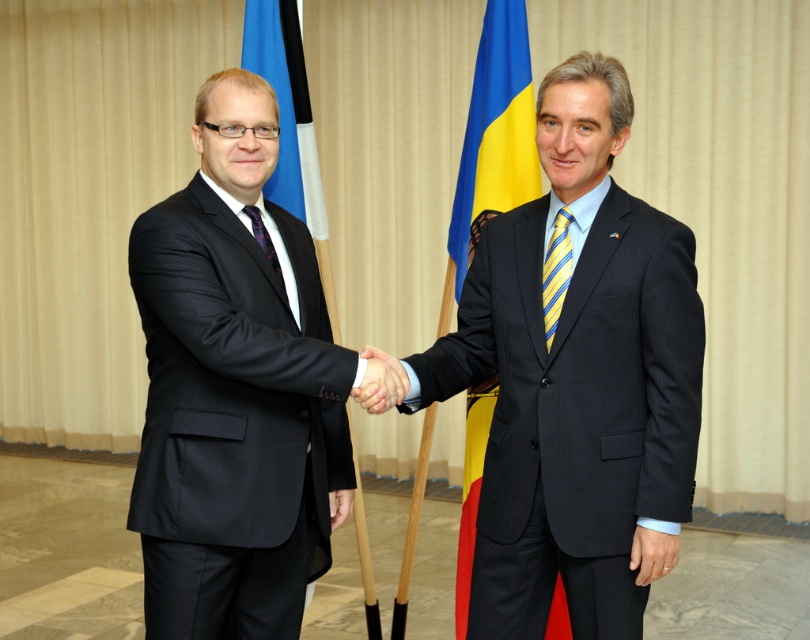
You are a photographer trying to capture a photo of the two men shaking hands. You notice two points in the image labeled as point 1 at coordinates point 1 at coordinates point (488, 612) and point 2 at coordinates point (382, 368). Which point is closer to the camera?

Point (382, 368) is closer to the camera because the Objects Description states that point (488, 612) is behind point (382, 368).